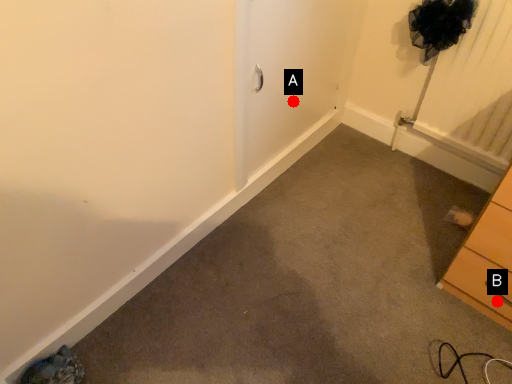
Question: Two points are circled on the image, labeled by A and B beside each circle. Which of the following is the farthest from the observer?

Choices:
 (A) A is further
 (B) B is further

Answer: (A)